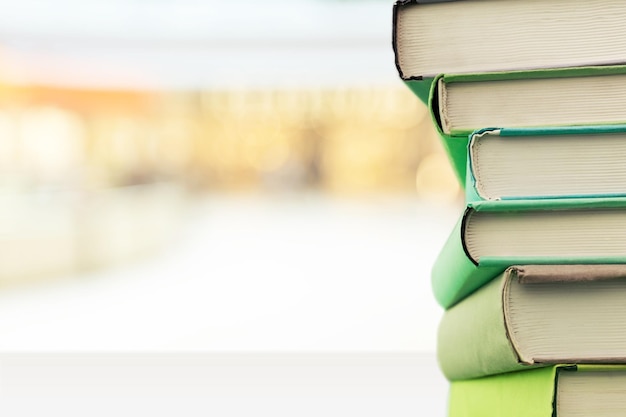
At what (x,y) coordinates should I click in order to perform the action: click on books. Please return your answer as a coordinate pair (x, y). Image resolution: width=626 pixels, height=417 pixels. Looking at the image, I should click on (540, 392), (553, 318), (572, 237), (551, 161), (551, 105), (545, 49).